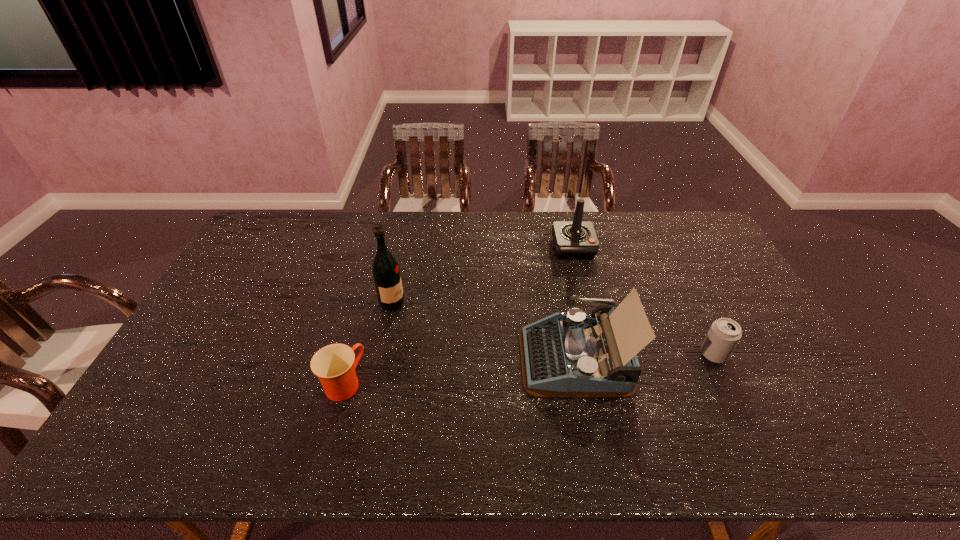
The width and height of the screenshot is (960, 540). Find the location of `the second farthest object`. the second farthest object is located at coordinates (386, 272).

Where is `liquor`? The image size is (960, 540). liquor is located at coordinates (386, 272).

Find the location of `the farthest object`. the farthest object is located at coordinates (572, 239).

Where is `typewriter`? This screenshot has width=960, height=540. typewriter is located at coordinates (565, 355).

At what (x,y) coordinates should I click in order to perform the action: click on the rightmost object. Please return your answer as a coordinate pair (x, y). Image resolution: width=960 pixels, height=540 pixels. Looking at the image, I should click on (724, 334).

This screenshot has height=540, width=960. Find the location of `cup`. cup is located at coordinates (334, 365).

Identify the location of free location located on the front-facing side of the tallest object. The width and height of the screenshot is (960, 540). (430, 304).

Find the location of a particular element. vacant space situated 0.390m on the front-facing side of the joystick is located at coordinates (598, 348).

Identify the location of free location located on the typing side of the typewriter. (445, 357).

At what (x,y) coordinates should I click in order to perform the action: click on vacant point located 0.150m on the typing side of the typewriter. Please return your answer as a coordinate pair (x, y). This screenshot has height=540, width=960. Looking at the image, I should click on (467, 357).